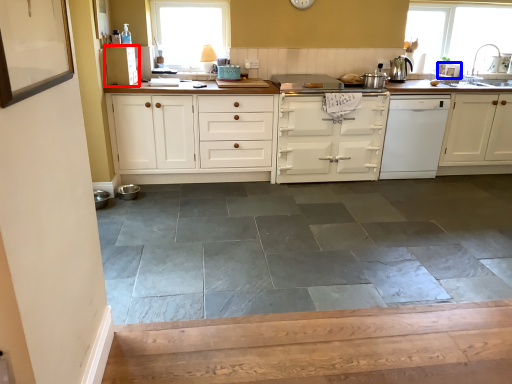
Question: Which point is closer to the camera, cabinetry (highlighted by a red box) or appliance (highlighted by a blue box)?

Choices:
 (A) cabinetry
 (B) appliance

Answer: (A)